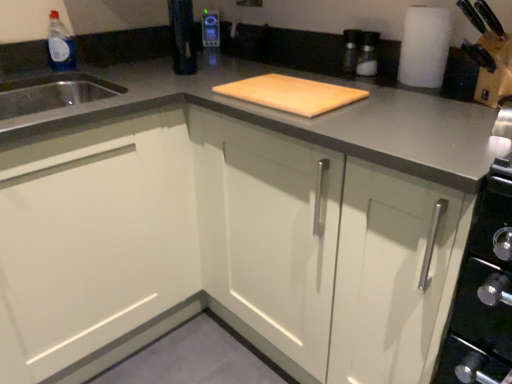
Locate an element on the screen. This screenshot has width=512, height=384. free region on the left part of white matte paper towel at upper right is located at coordinates (377, 88).